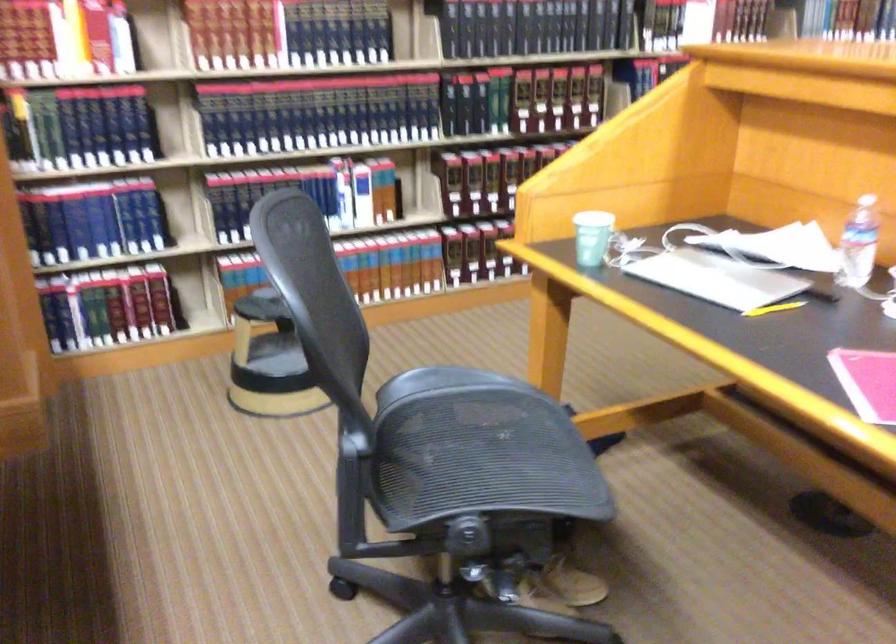
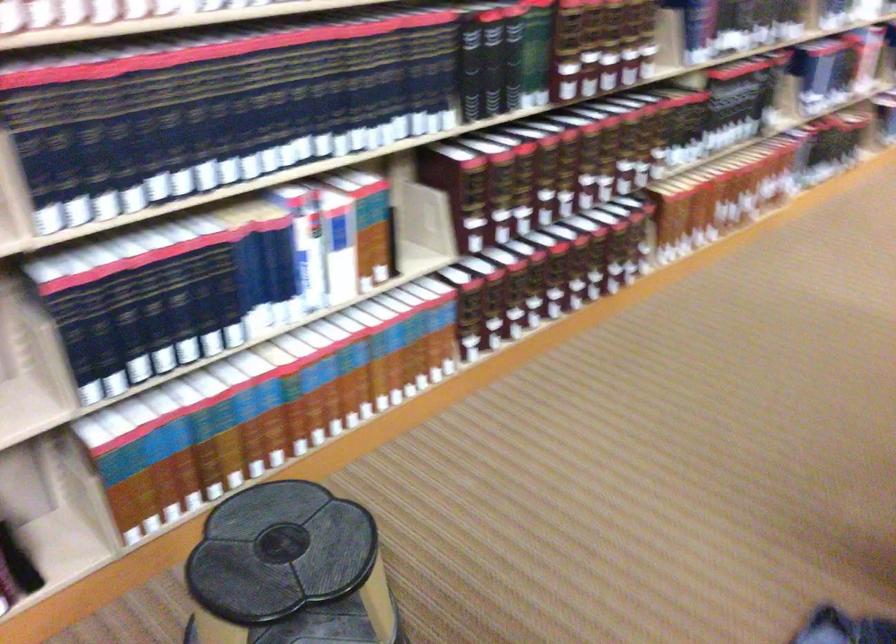
In the second image, find the point that corresponds to [334,109] in the first image.

(297, 104)